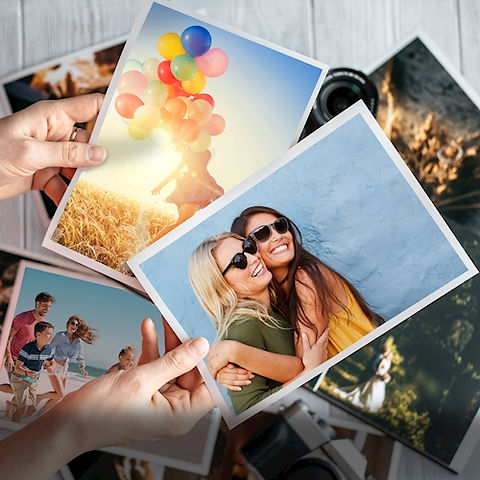
Locate an element on the screen. The image size is (480, 480). photographs is located at coordinates (72, 80), (188, 98), (417, 107), (396, 190), (70, 319), (384, 372), (119, 470).